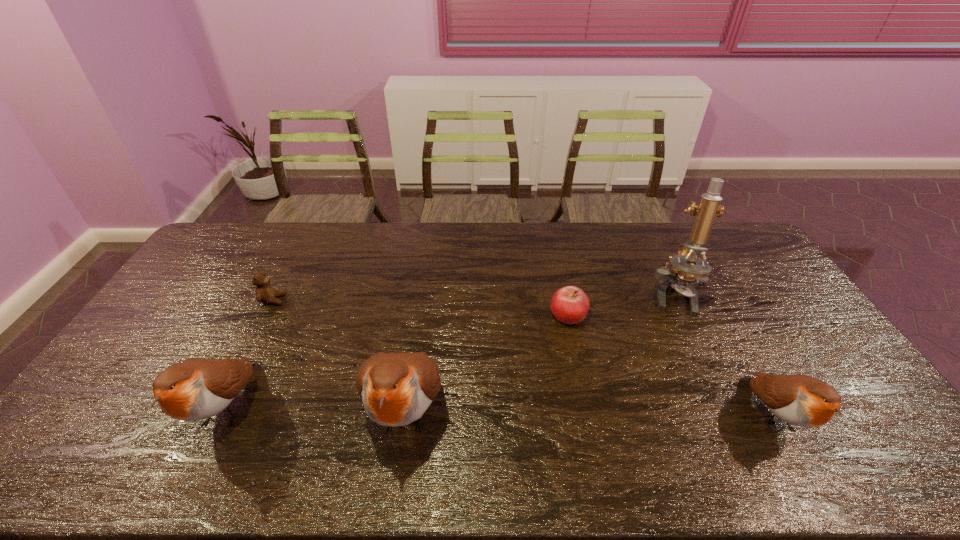
Where is `the second shortest bird`? This screenshot has height=540, width=960. the second shortest bird is located at coordinates (194, 389).

Locate an element on the screen. The width and height of the screenshot is (960, 540). the third tallest object is located at coordinates (194, 389).

Where is `the third object from left to right`? This screenshot has height=540, width=960. the third object from left to right is located at coordinates (396, 389).

Locate an element on the screen. the rightmost bird is located at coordinates (800, 400).

Locate an element on the screen. Image resolution: width=960 pixels, height=540 pixels. the shortest bird is located at coordinates (800, 400).

Where is `teddy bear`? teddy bear is located at coordinates (265, 293).

Identify the location of microscope. This screenshot has height=540, width=960. (688, 268).

Where is `apple`? The width and height of the screenshot is (960, 540). apple is located at coordinates (570, 305).

Where is `free space located at the face of the teddy bear`? free space located at the face of the teddy bear is located at coordinates (354, 300).

Where is `vacant space located 0.200m on the back of the microscope`? vacant space located 0.200m on the back of the microscope is located at coordinates (647, 242).